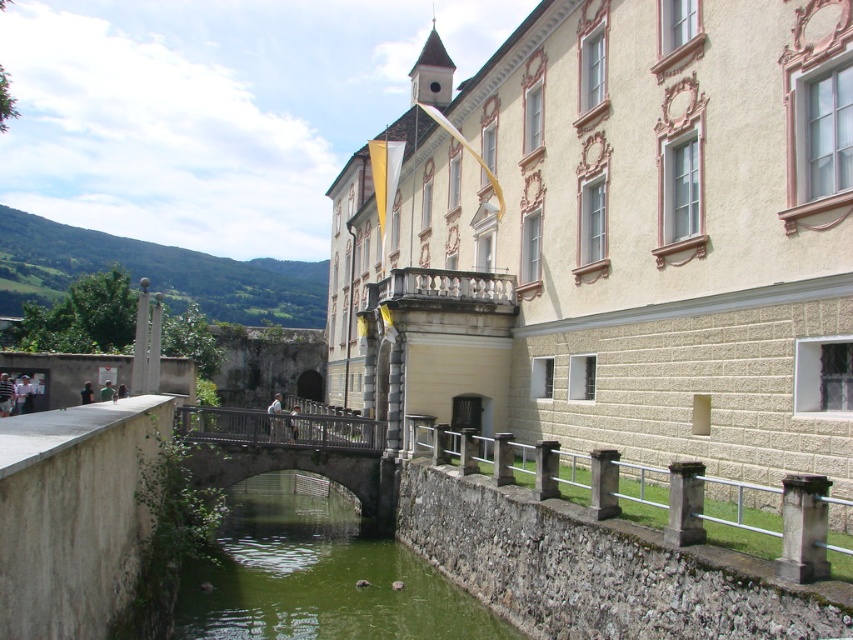
Is point (279, 492) positioned before point (187, 436)?

That is False.

Does green stone river at center have a larger size compared to wooden bridge at center?

Yes, green stone river at center is bigger than wooden bridge at center.

Who is more forward, (312, 592) or (277, 413)?

Positioned in front is point (312, 592).

Locate an element on the screen. The image size is (853, 640). green stone river at center is located at coordinates (317, 576).

Between point (651, 490) and point (225, 419), which one is positioned behind?

The point (225, 419) is behind.

Can you confirm if stone/rustic fence at lower right is positioned to the right of wooden bridge at center?

Yes, stone/rustic fence at lower right is to the right of wooden bridge at center.

Is point (447, 458) less distant than point (368, 422)?

Yes, point (447, 458) is closer to viewer.

Find the location of a particular element. stone/rustic fence at lower right is located at coordinates (648, 497).

Which is above, green stone river at center or stone/rustic fence at lower right?

Positioned higher is stone/rustic fence at lower right.

Where is `green stone river at center`? Image resolution: width=853 pixels, height=640 pixels. green stone river at center is located at coordinates (317, 576).

What are the coordinates of `green stone river at center` in the screenshot? It's located at (317, 576).